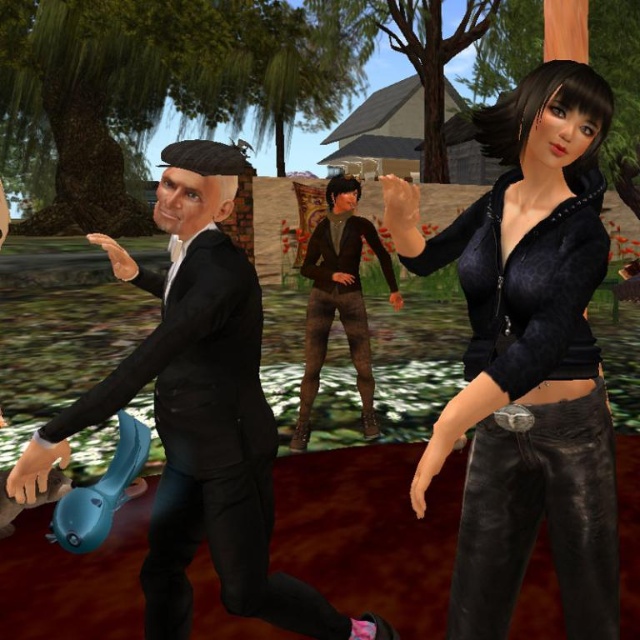
Question: Which point is closer to the camera?

Choices:
 (A) black matte suit at left
 (B) velvet black jacket at center

Answer: (B)

Question: Estimate the real-world distances between objects in this image. Which object is closer to the velvet black jacket at center?

Choices:
 (A) black matte suit at left
 (B) brown leather pants at center

Answer: (A)

Question: Is velvet black jacket at center smaller than brown leather pants at center?

Choices:
 (A) yes
 (B) no

Answer: (A)

Question: In this image, where is velvet black jacket at center located relative to black matte suit at left?

Choices:
 (A) below
 (B) above

Answer: (B)

Question: Which point is closer to the camera?

Choices:
 (A) black matte suit at left
 (B) brown leather pants at center
 (C) velvet black jacket at center

Answer: (C)

Question: Does velvet black jacket at center have a greater width compared to brown leather pants at center?

Choices:
 (A) no
 (B) yes

Answer: (A)